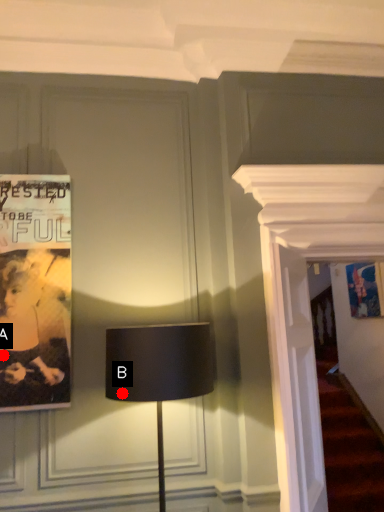
Question: Two points are circled on the image, labeled by A and B beside each circle. Which point is closer to the camera?

Choices:
 (A) A is closer
 (B) B is closer

Answer: (B)